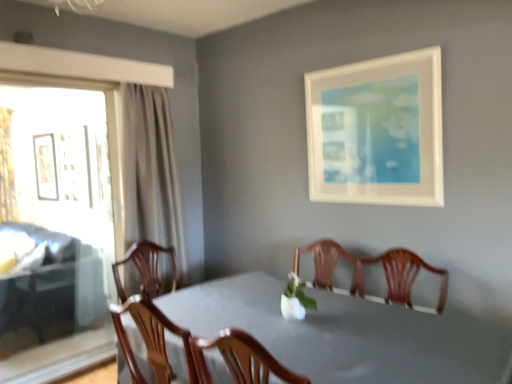
Question: Does smooth gray table at center contain gold textured curtain at left?

Choices:
 (A) yes
 (B) no

Answer: (B)

Question: Is smooth gray table at center not within gold textured curtain at left?

Choices:
 (A) yes
 (B) no

Answer: (A)

Question: Is smooth gray table at center smaller than gold textured curtain at left?

Choices:
 (A) no
 (B) yes

Answer: (A)

Question: Can you confirm if smooth gray table at center is positioned to the right of gold textured curtain at left?

Choices:
 (A) no
 (B) yes

Answer: (B)

Question: From the image's perspective, is smooth gray table at center on top of gold textured curtain at left?

Choices:
 (A) no
 (B) yes

Answer: (A)

Question: Is smooth gray table at center bigger or smaller than white matte vase at center?

Choices:
 (A) big
 (B) small

Answer: (A)

Question: From the image's perspective, is smooth gray table at center positioned above or below white matte vase at center?

Choices:
 (A) below
 (B) above

Answer: (A)

Question: From a real-world perspective, relative to white matte vase at center, is smooth gray table at center vertically above or below?

Choices:
 (A) above
 (B) below

Answer: (B)

Question: Is smooth gray table at center to the left or to the right of white matte vase at center in the image?

Choices:
 (A) left
 (B) right

Answer: (B)

Question: Based on their positions, is gold textured curtain at left located to the left or right of matte black picture frame at left, which appears as the 1th picture frame when viewed from the back?

Choices:
 (A) left
 (B) right

Answer: (A)

Question: Is gold textured curtain at left wider or thinner than matte black picture frame at left, arranged as the 2th picture frame when viewed from the front?

Choices:
 (A) thin
 (B) wide

Answer: (B)

Question: Do you think gold textured curtain at left is within matte black picture frame at left, which appears as the 1th picture frame when viewed from the back, or outside of it?

Choices:
 (A) inside
 (B) outside

Answer: (B)

Question: Looking at the image, does gold textured curtain at left seem bigger or smaller compared to matte black picture frame at left, which ranks as the second picture frame in right-to-left order?

Choices:
 (A) small
 (B) big

Answer: (B)

Question: Is matte black picture frame at left, arranged as the 2th picture frame when viewed from the front, wider or thinner than transparent glass window at left?

Choices:
 (A) thin
 (B) wide

Answer: (A)

Question: Based on their positions, is matte black picture frame at left, which ranks as the second picture frame in right-to-left order, located to the left or right of transparent glass window at left?

Choices:
 (A) left
 (B) right

Answer: (A)